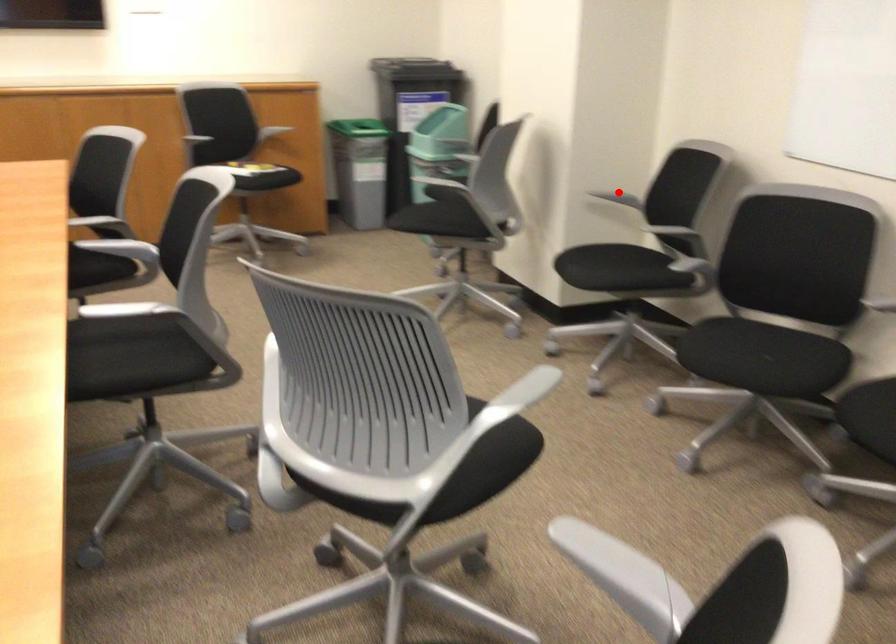
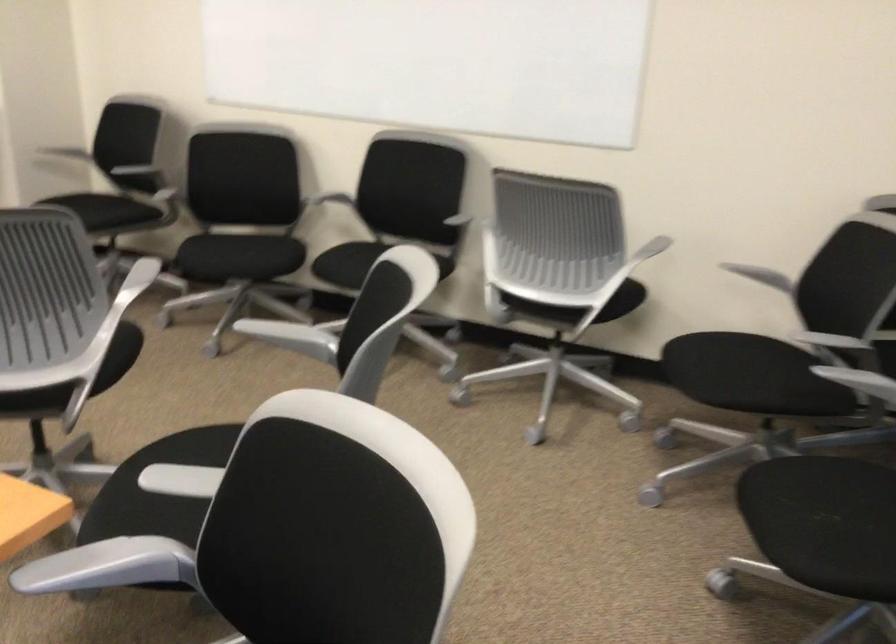
The point at the highlighted location is marked in the first image. Where is the corresponding point in the second image?

(83, 149)